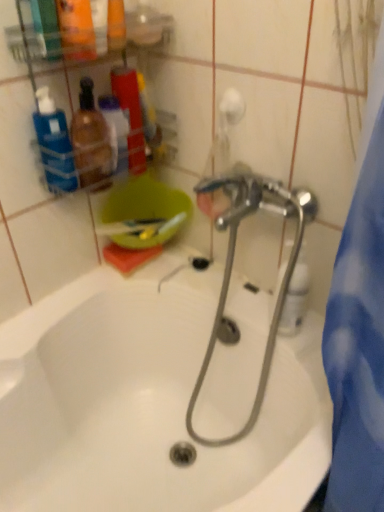
Question: Is white glossy bathtub at center in front of or behind translucent plastic bottles at left, the 2th toiletry from the right, in the image?

Choices:
 (A) front
 (B) behind

Answer: (A)

Question: From the image's perspective, relative to translucent plastic bottles at left, arranged as the 1th toiletry when viewed from the left, is white glossy bathtub at center above or below?

Choices:
 (A) below
 (B) above

Answer: (A)

Question: Which object is positioned farthest from the blue plastic bottle at upper left, which ranks as the 2th cleaning product in bottom-to-top order?

Choices:
 (A) translucent plastic bottles at left, the 2th toiletry from the right
 (B) white glossy bathtub at center
 (C) clear plastic spray bottle at center, which is the second cleaning product in left-to-right order
 (D) translucent plastic bottles at upper left, which is counted as the 1th toiletry, starting from the right

Answer: (B)

Question: Which is nearer to the translucent plastic bottles at upper left, which is counted as the 1th toiletry, starting from the right?

Choices:
 (A) white glossy bathtub at center
 (B) blue plastic bottle at upper left, which ranks as the 2th cleaning product in bottom-to-top order
 (C) clear plastic spray bottle at center, placed as the 1th cleaning product when sorted from right to left
 (D) translucent plastic bottles at left, arranged as the 1th toiletry when viewed from the left

Answer: (D)